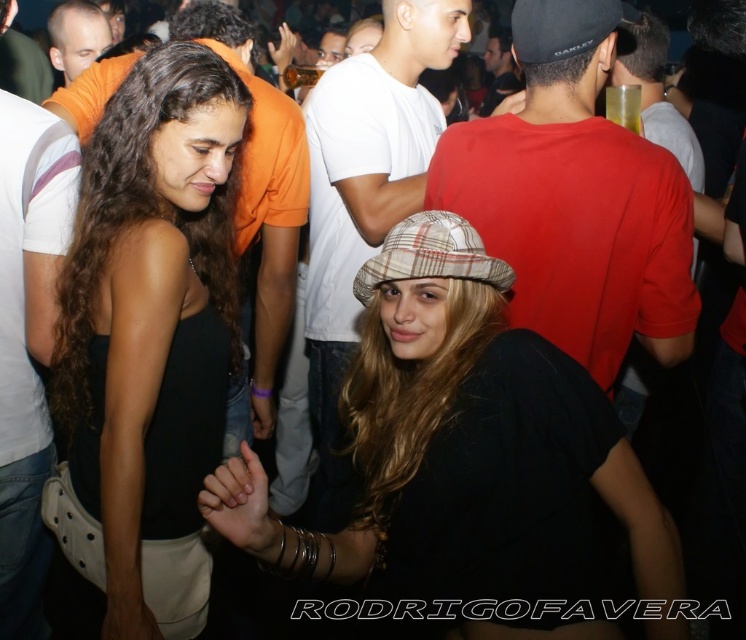
Question: Which object appears closest to the camera in this image?

Choices:
 (A) plaid fabric hat at center
 (B) matte black tank top at center

Answer: (A)

Question: Where is matte black tank top at center located in relation to matte red shirt at center in the image?

Choices:
 (A) below
 (B) above

Answer: (A)

Question: Estimate the real-world distances between objects in this image. Which object is farther from the orange t-shirt at upper left?

Choices:
 (A) white cotton t-shirt at center
 (B) white striped t-shirt at left
 (C) plaid fabric hat at center

Answer: (C)

Question: Does matte red shirt at center appear under white cotton t-shirt at center?

Choices:
 (A) yes
 (B) no

Answer: (B)

Question: Which object is positioned closest to the matte red shirt at center?

Choices:
 (A) plaid fabric hat at center
 (B) orange t-shirt at upper left
 (C) matte black tank top at center

Answer: (A)

Question: From the image, what is the correct spatial relationship of plaid fabric hat at center in relation to matte red shirt at center?

Choices:
 (A) left
 (B) right

Answer: (A)